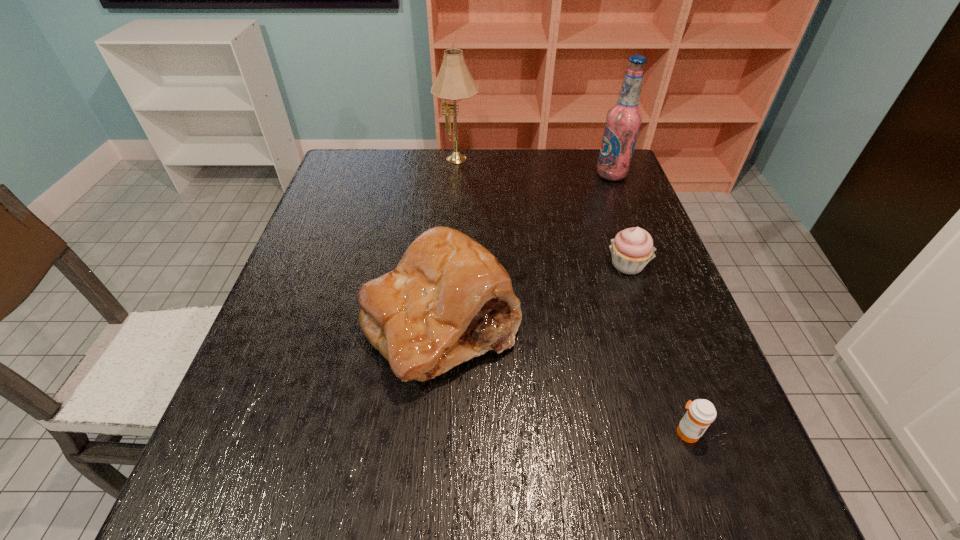
Identify the location of free spot located on the back of the nearest object. Image resolution: width=960 pixels, height=540 pixels. (645, 313).

At what (x,y) coordinates should I click in order to perform the action: click on lampshade present at the far edge. Please return your answer as a coordinate pair (x, y). The width and height of the screenshot is (960, 540). Looking at the image, I should click on (454, 82).

Where is `alcohol positioned at the far edge`? The image size is (960, 540). alcohol positioned at the far edge is located at coordinates (623, 121).

Identify the location of alcohol present at the right edge. The width and height of the screenshot is (960, 540). (623, 121).

The height and width of the screenshot is (540, 960). In order to click on cupcake present at the right edge in this screenshot , I will do `click(632, 248)`.

What are the coordinates of `medicine located at the right edge` in the screenshot? It's located at pos(701,413).

The width and height of the screenshot is (960, 540). What are the coordinates of `object located at the far right corner` in the screenshot? It's located at (623, 121).

You are a GUI agent. You are given a task and a screenshot of the screen. Output one action in this format:
    pyautogui.click(x=<x>, y=<y>)
    Task: Click on the vacant space at the far edge of the desktop
    This screenshot has height=540, width=960.
    Given the screenshot: What is the action you would take?
    pyautogui.click(x=491, y=150)

You are a GUI agent. You are given a task and a screenshot of the screen. Output one action in this format:
    pyautogui.click(x=<x>, y=<y>)
    Task: Click on the free region at the near edge of the desktop
    
    Given the screenshot: What is the action you would take?
    pyautogui.click(x=600, y=523)

Where is `vacant space at the left edge of the desktop`? The image size is (960, 540). vacant space at the left edge of the desktop is located at coordinates (298, 276).